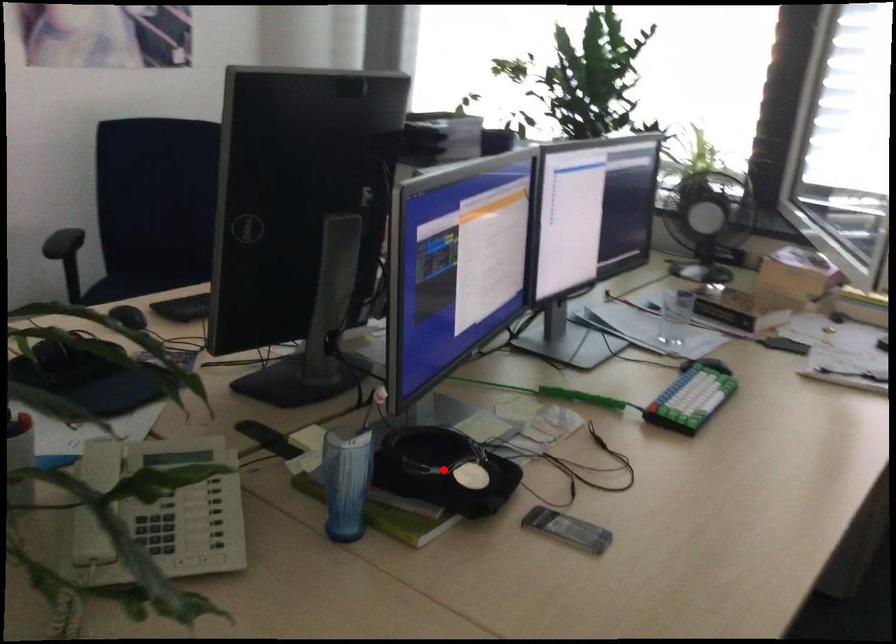
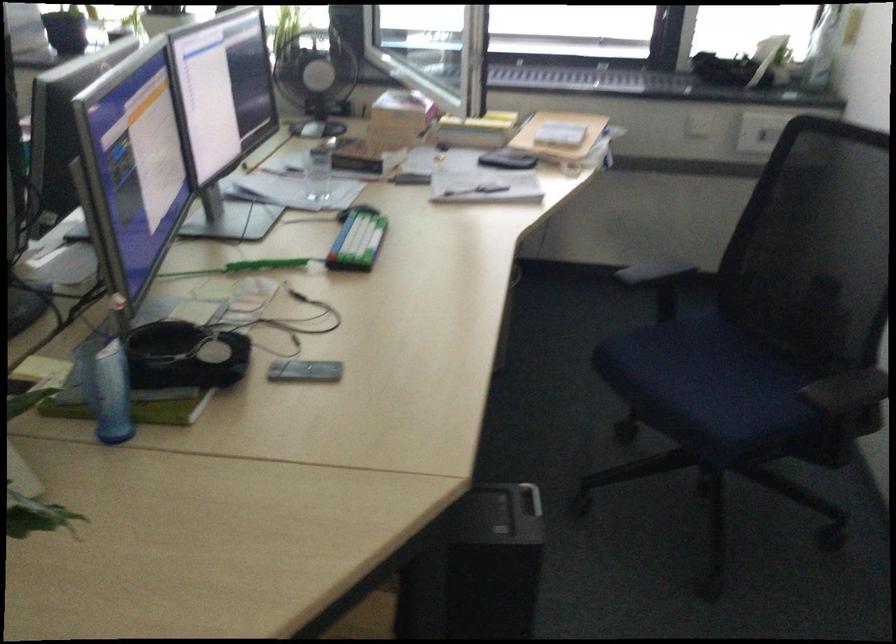
Where in the second image is the point corresponding to the highlighted location from the first image?

(185, 355)